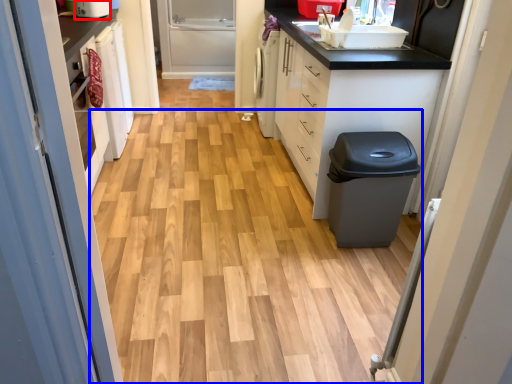
Question: Which object is closer to the camera taking this photo, appliance (highlighted by a red box) or plain (highlighted by a blue box)?

Choices:
 (A) appliance
 (B) plain

Answer: (B)